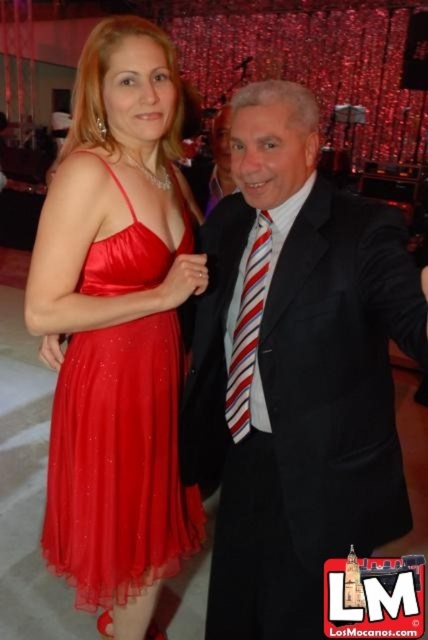
At what (x,y) coordinates should I click in order to perform the action: click on black satin suit at center. Please return your answer as a coordinate pair (x, y). The image size is (428, 640). Looking at the image, I should click on (294, 372).

Is black satin suit at center to the right of satin dress at left from the viewer's perspective?

Yes, black satin suit at center is to the right of satin dress at left.

Is point (237, 614) less distant than point (133, 508)?

No, it is not.

Where is `black satin suit at center`? black satin suit at center is located at coordinates (294, 372).

Does satin dress at left appear under striped fabric tie at center?

Yes.

Is satin dress at left further to the viewer compared to striped fabric tie at center?

That is True.

Locate an element on the screen. satin dress at left is located at coordinates (118, 461).

Which is more to the right, black satin suit at center or striped fabric tie at center?

black satin suit at center

Is black satin suit at center below striped fabric tie at center?

Yes.

Is point (211, 579) positioned after point (249, 420)?

Yes.

Where is `black satin suit at center`? The width and height of the screenshot is (428, 640). black satin suit at center is located at coordinates (294, 372).